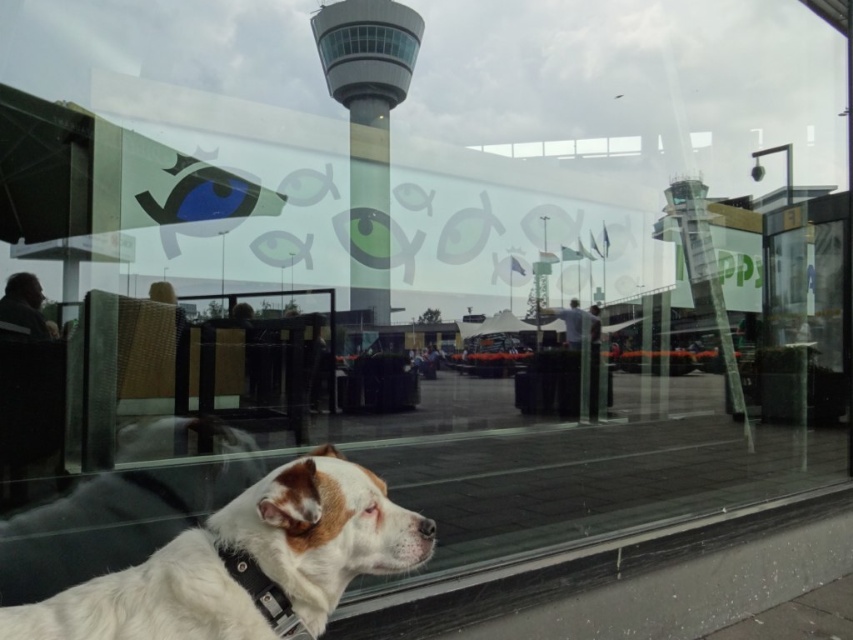
Does white fur dog at lower left have a greater width compared to black leather neckband at lower left?

Indeed, white fur dog at lower left has a greater width compared to black leather neckband at lower left.

Is point (184, 589) positioned before point (222, 548)?

Yes, it is.

Where is `white fur dog at lower left`? white fur dog at lower left is located at coordinates (251, 557).

Who is positioned more to the left, smooth glass control tower at center or black leather neckband at lower left?

smooth glass control tower at center

Who is higher up, smooth glass control tower at center or black leather neckband at lower left?

smooth glass control tower at center is above.

Where is `smooth glass control tower at center`? smooth glass control tower at center is located at coordinates (368, 124).

How much distance is there between white fur dog at lower left and smooth glass control tower at center?

8.74 feet

Does white fur dog at lower left appear on the left side of smooth glass control tower at center?

Indeed, white fur dog at lower left is positioned on the left side of smooth glass control tower at center.

Between point (341, 460) and point (357, 13), which one is positioned in front?

Point (341, 460)

Image resolution: width=853 pixels, height=640 pixels. I want to click on white fur dog at lower left, so coord(251,557).